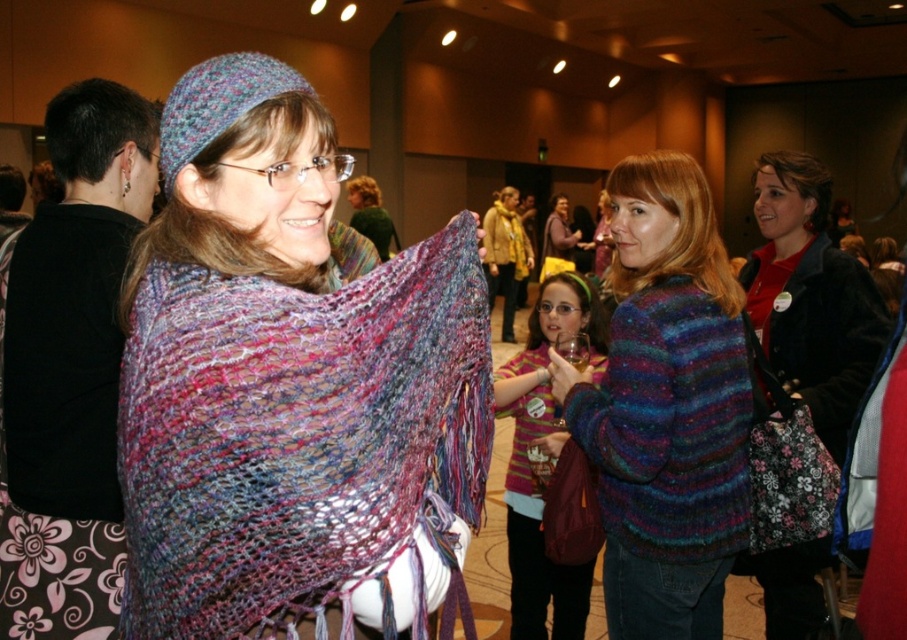
Question: Which point is closer to the camera?

Choices:
 (A) multicolored knitted shawl at left
 (B) yellow knit scarf at center

Answer: (A)

Question: Is multicolored knitted sweater at center to the right of velvet red coat at center from the viewer's perspective?

Choices:
 (A) no
 (B) yes

Answer: (A)

Question: Which point is closer to the camera?

Choices:
 (A) multicolored knitted shawl at left
 (B) velvet red coat at center
 (C) striped sweater at center

Answer: (A)

Question: Which point is closer to the camera?

Choices:
 (A) (618, 397)
 (B) (517, 202)

Answer: (A)

Question: Can you confirm if multicolored knitted sweater at center is positioned below velvet red coat at center?

Choices:
 (A) no
 (B) yes

Answer: (B)

Question: Does multicolored knitted sweater at center appear under velvet red coat at center?

Choices:
 (A) yes
 (B) no

Answer: (A)